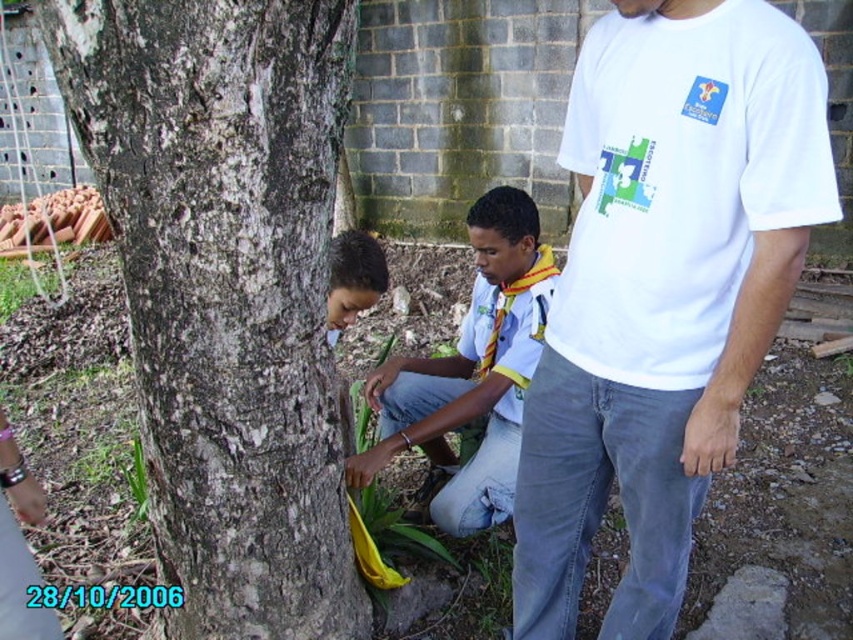
Who is taller, rough bark tree at center or yellow fabric at center?

Standing taller between the two is rough bark tree at center.

Between point (151, 429) and point (488, 420), which one is positioned in front?

Point (151, 429) is in front.

This screenshot has width=853, height=640. I want to click on rough bark tree at center, so coord(225,289).

Can you confirm if white cotton t-shirt at right is thinner than yellow fabric at center?

Indeed, white cotton t-shirt at right has a lesser width compared to yellow fabric at center.

Does white cotton t-shirt at right appear over yellow fabric at center?

No.

The width and height of the screenshot is (853, 640). I want to click on white cotton t-shirt at right, so click(663, 289).

Based on the photo, which is more to the right, yellow fabric at center or smooth brown hair at lower center?

yellow fabric at center is more to the right.

Looking at this image, who is shorter, yellow fabric at center or smooth brown hair at lower center?

Standing shorter between the two is smooth brown hair at lower center.

Does point (490, 189) come in front of point (370, 285)?

No.

Find the location of a particular element. The width and height of the screenshot is (853, 640). yellow fabric at center is located at coordinates (471, 374).